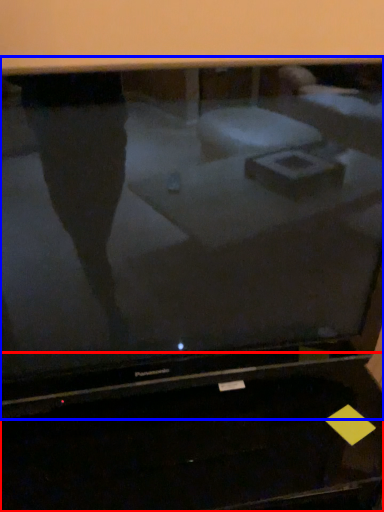
Question: Among these objects, which one is farthest to the camera, desktop (highlighted by a red box) or television (highlighted by a blue box)?

Choices:
 (A) desktop
 (B) television

Answer: (A)